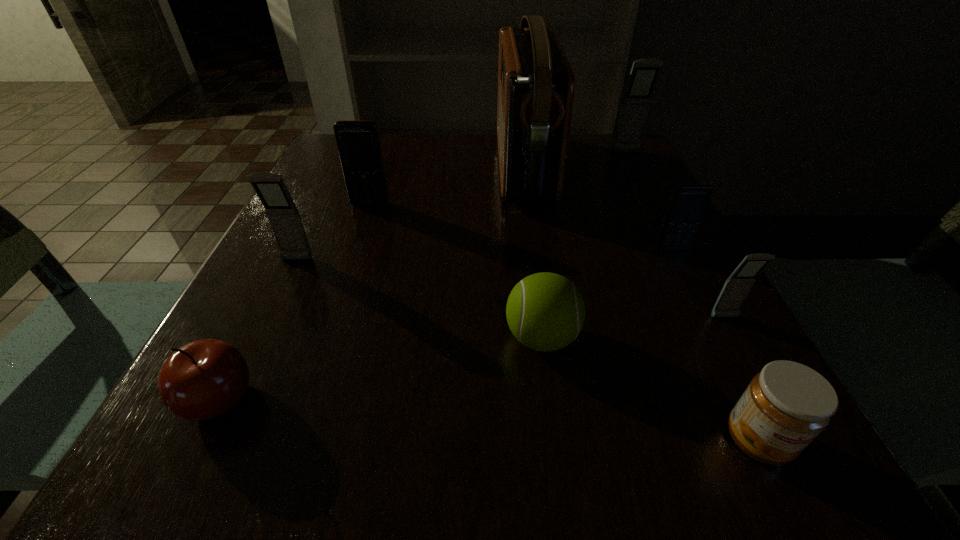
You are a GUI agent. You are given a task and a screenshot of the screen. Output one action in this format:
    pyautogui.click(x=<x>, y=<y>)
    Task: Click on the object at the near left corner
    This screenshot has height=540, width=960.
    Given the screenshot: What is the action you would take?
    (204, 379)

Identify the location of object at the far right corner. The width and height of the screenshot is (960, 540). (644, 74).

Identify the location of object located in the near right corner section of the desktop. (787, 405).

In the image, there is a desktop. Where is `vacant space at the far edge`? vacant space at the far edge is located at coordinates (432, 134).

Locate an element on the screen. The width and height of the screenshot is (960, 540). free space at the near edge is located at coordinates (597, 463).

Locate an element on the screen. The width and height of the screenshot is (960, 540). free space at the left edge of the desktop is located at coordinates (315, 217).

The width and height of the screenshot is (960, 540). Find the location of `free space at the right edge`. free space at the right edge is located at coordinates (636, 179).

The height and width of the screenshot is (540, 960). I want to click on blank space at the far right corner of the desktop, so click(x=640, y=162).

Locate an element on the screen. This screenshot has height=540, width=960. vacant area that lies between the orange jam and the apple is located at coordinates (489, 420).

Image resolution: width=960 pixels, height=540 pixels. Find the location of `free space between the green tennis ball and the fourth nearest cellular telephone`. free space between the green tennis ball and the fourth nearest cellular telephone is located at coordinates (456, 271).